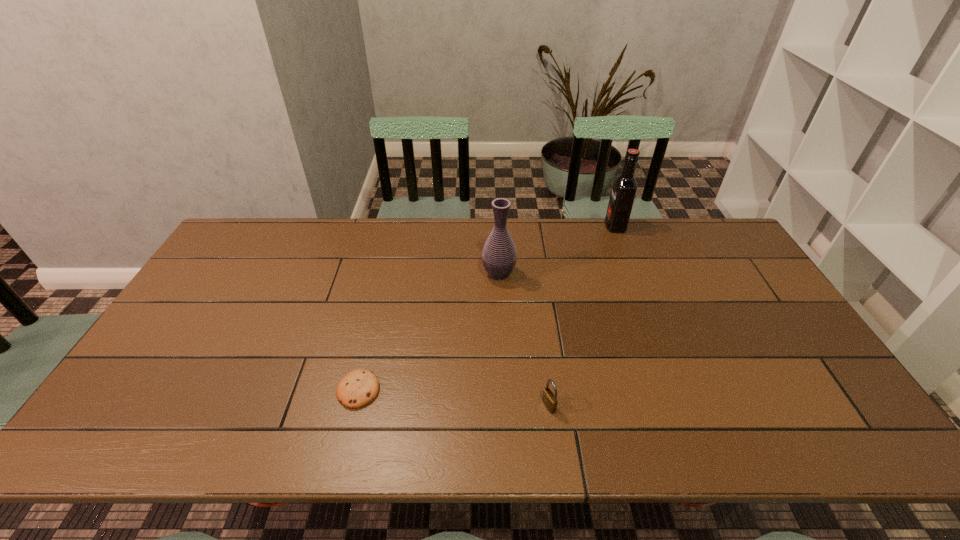
This screenshot has width=960, height=540. I want to click on the farthest object, so click(624, 187).

This screenshot has width=960, height=540. Find the location of `the rightmost object`. the rightmost object is located at coordinates (x=624, y=187).

The height and width of the screenshot is (540, 960). I want to click on vase, so click(x=499, y=255).

At what (x,y) coordinates should I click in order to perform the action: click on the third object from right to left. Please return your answer as a coordinate pair (x, y). Looking at the image, I should click on (499, 255).

This screenshot has width=960, height=540. In order to click on padlock in this screenshot , I will do `click(549, 399)`.

This screenshot has width=960, height=540. In order to click on the second object from right to left in this screenshot , I will do `click(549, 399)`.

The image size is (960, 540). I want to click on cookie, so click(357, 388).

The image size is (960, 540). Find the location of `the leftmost object`. the leftmost object is located at coordinates (357, 388).

Find the location of a particular element. free space located 0.210m on the front-facing side of the rightmost object is located at coordinates (547, 226).

Image resolution: width=960 pixels, height=540 pixels. What are the coordinates of `free space located on the front-facing side of the rightmost object` in the screenshot? It's located at (574, 226).